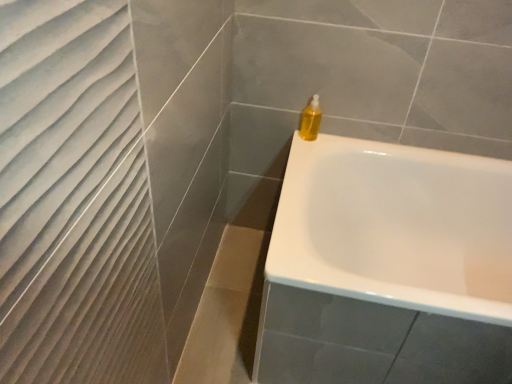
Question: Is translucent yellow liquid at upper right to the right of white glossy bathtub at upper right from the viewer's perspective?

Choices:
 (A) no
 (B) yes

Answer: (A)

Question: Is translucent yellow liquid at upper right in contact with white glossy bathtub at upper right?

Choices:
 (A) no
 (B) yes

Answer: (A)

Question: From a real-world perspective, does translucent yellow liquid at upper right sit lower than white glossy bathtub at upper right?

Choices:
 (A) no
 (B) yes

Answer: (A)

Question: Is the position of translucent yellow liquid at upper right less distant than that of white glossy bathtub at upper right?

Choices:
 (A) yes
 (B) no

Answer: (B)

Question: Does translucent yellow liquid at upper right have a lesser height compared to white glossy bathtub at upper right?

Choices:
 (A) yes
 (B) no

Answer: (A)

Question: Is white glossy bathtub at upper right surrounded by translucent yellow liquid at upper right?

Choices:
 (A) no
 (B) yes

Answer: (A)

Question: Is white glossy bathtub at upper right looking in the opposite direction of translucent yellow liquid at upper right?

Choices:
 (A) no
 (B) yes

Answer: (A)

Question: Considering the relative positions of white glossy bathtub at upper right and translucent yellow liquid at upper right in the image provided, is white glossy bathtub at upper right to the left of translucent yellow liquid at upper right from the viewer's perspective?

Choices:
 (A) no
 (B) yes

Answer: (A)

Question: Are white glossy bathtub at upper right and translucent yellow liquid at upper right far apart?

Choices:
 (A) no
 (B) yes

Answer: (A)

Question: From the image's perspective, is white glossy bathtub at upper right below translucent yellow liquid at upper right?

Choices:
 (A) no
 (B) yes

Answer: (B)

Question: Is white glossy bathtub at upper right not inside translucent yellow liquid at upper right?

Choices:
 (A) no
 (B) yes

Answer: (B)

Question: Can you confirm if white glossy bathtub at upper right is bigger than translucent yellow liquid at upper right?

Choices:
 (A) yes
 (B) no

Answer: (A)

Question: From the image's perspective, is translucent yellow liquid at upper right above or below white glossy bathtub at upper right?

Choices:
 (A) below
 (B) above

Answer: (B)